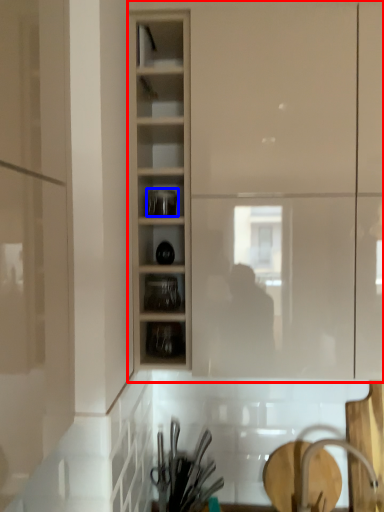
Question: Among these objects, which one is farthest to the camera, cupboard (highlighted by a red box) or tableware (highlighted by a blue box)?

Choices:
 (A) cupboard
 (B) tableware

Answer: (B)